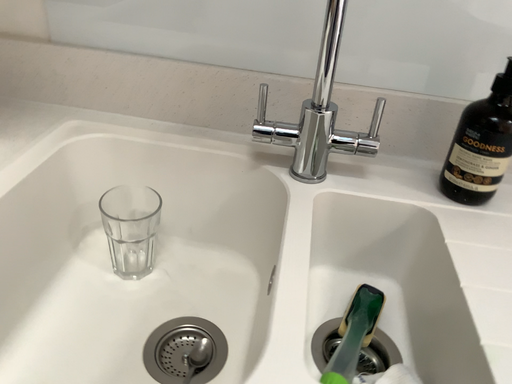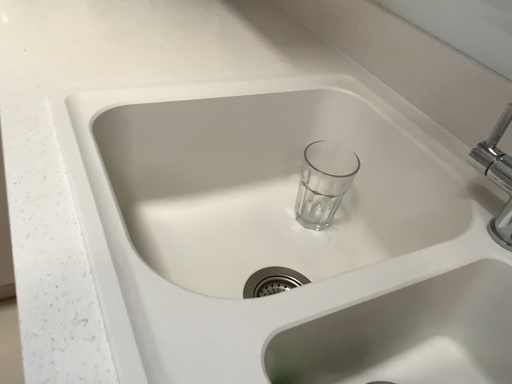
Question: How did the camera likely rotate when shooting the video?

Choices:
 (A) rotated left
 (B) rotated right

Answer: (A)